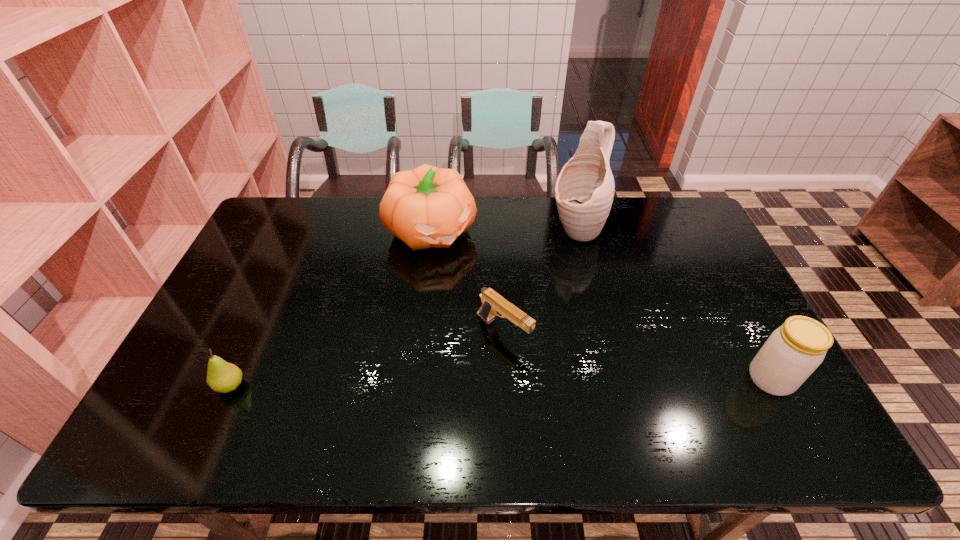
Where is `vacant space that's between the third object from left to right and the fourth object from left to right`? The image size is (960, 540). vacant space that's between the third object from left to right and the fourth object from left to right is located at coordinates (540, 281).

The image size is (960, 540). Find the location of `free space between the jar and the third object from right to left`. free space between the jar and the third object from right to left is located at coordinates (637, 355).

Select which object is the closest to the pumpkin. Please provide its 2D coordinates. Your answer should be formatted as a tuple, i.e. [(x, y)], where the tuple contains the x and y coordinates of a point satisfying the conditions above.

[(493, 304)]

Choose which object is the third nearest neighbor to the rightmost object. Please provide its 2D coordinates. Your answer should be formatted as a tuple, i.e. [(x, y)], where the tuple contains the x and y coordinates of a point satisfying the conditions above.

[(425, 207)]

Find the location of `vacant region that satisfies the following two spatial constraints: 1. on the back side of the third object from right to left; 2. on the right side of the fourth object from left to right`. vacant region that satisfies the following two spatial constraints: 1. on the back side of the third object from right to left; 2. on the right side of the fourth object from left to right is located at coordinates (498, 231).